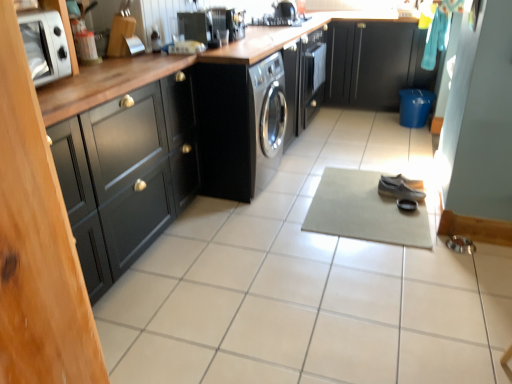
The width and height of the screenshot is (512, 384). Identify the location of free spot to the right of satin black washing machine at center. (304, 172).